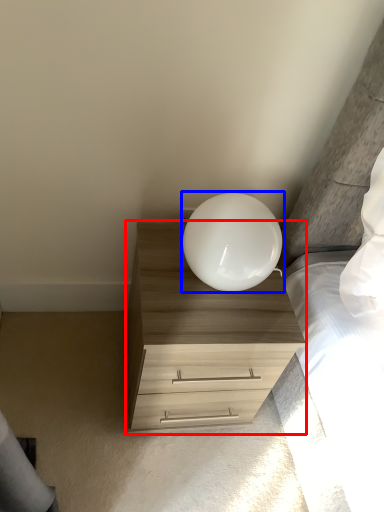
Question: Which point is further to the camera, chest of drawers (highlighted by a red box) or lamp (highlighted by a blue box)?

Choices:
 (A) chest of drawers
 (B) lamp

Answer: (A)